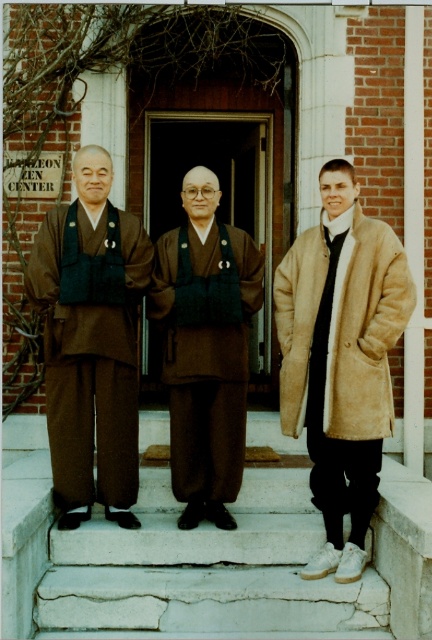
Based on the photo, you are a visitor at the Kaleon Zen Center and notice two robes hanging on a rack in the entrance area. The brown matte kimono at center and the brown woolen robe at center. Which robe would require a larger hanger to accommodate its size?

The brown woolen robe at center requires a larger hanger because it is bigger than the brown matte kimono at center.

You are a tailor observing the two garments worn by the central figure in the image. The garments are the brown matte kimono at center and the brown woolen robe at center. Given that the minimum recommended distance between two garments for proper airflow is 15 inches, can you determine if the current spacing between them meets this requirement?

The brown matte kimono at center and brown woolen robe at center are 15.69 inches apart, which exceeds the minimum recommended distance of 15 inches. Therefore, the spacing between them does meet the airflow requirement.

Based on the coordinates provided, which object is located at point (206, 348)?

The point (206, 348) marks the brown woolen robe at center.